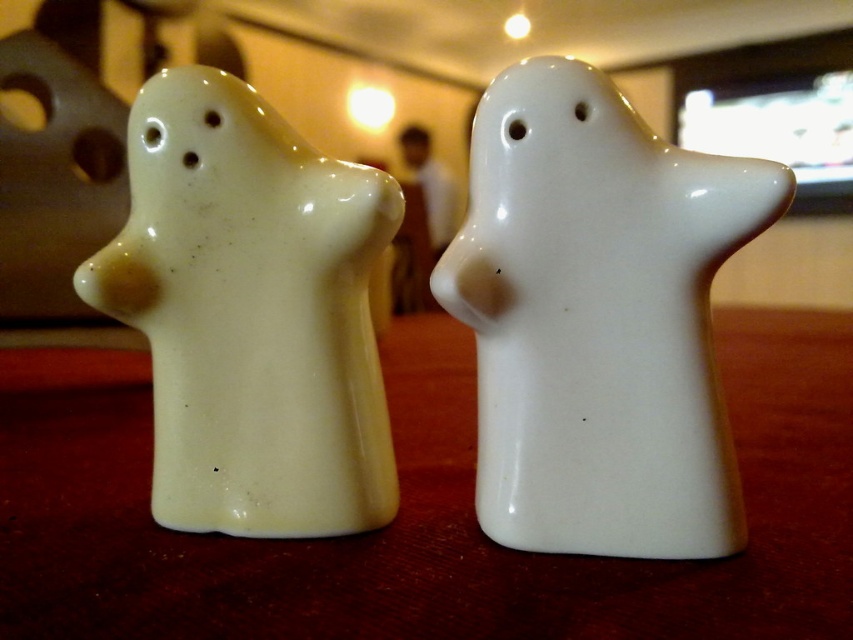
You are arranging a dinner table and need to place a centerpiece exactly at the coordinates point [598,317]. The white glossy ghost at center is currently occupying that spot. What should you do to make space?

The point [598,317] corresponds to the white glossy ghost at center, so you should move the white glossy ghost at center to another location to make space for the centerpiece.

You are setting up a dining table and need to place a centerpiece in front of the matte white ghost at left. Where should you place it relative to the white glossy table at center?

The white glossy table at center is in front of the matte white ghost at left, so the centerpiece should be placed in front of the white glossy table at center to ensure it is positioned in front of the matte white ghost at left.

You are taking a photo of the salt and pepper shakers and notice two points in the image. You want to focus on the point that is closer to the camera. Which point should you choose between point (155, 534) and point (625, 371)?

Point (155, 534) is further to the camera than point (625, 371). Therefore, the point closer to the camera is point (625, 371).